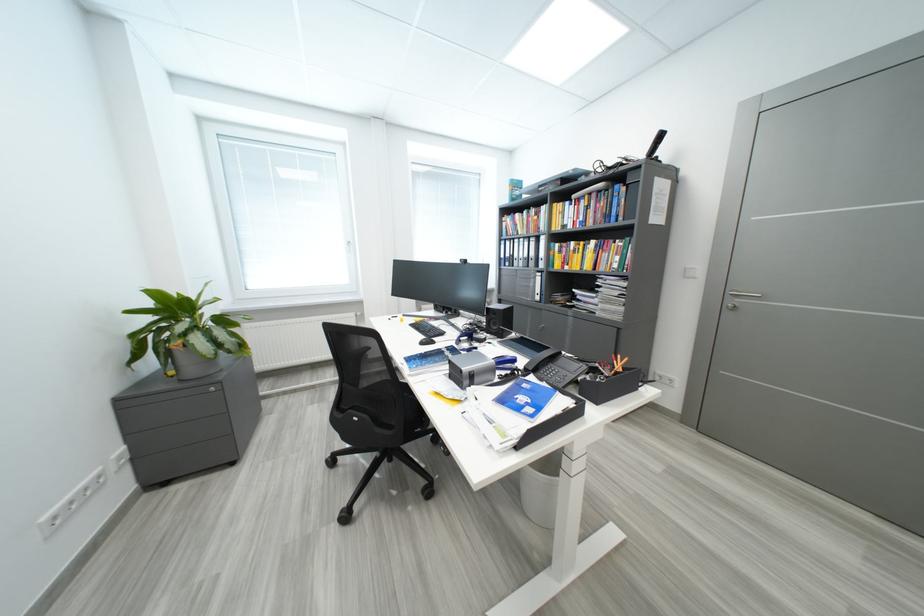
This screenshot has width=924, height=616. What are the coordinates of `silver door handle` in the screenshot? It's located at (743, 294).